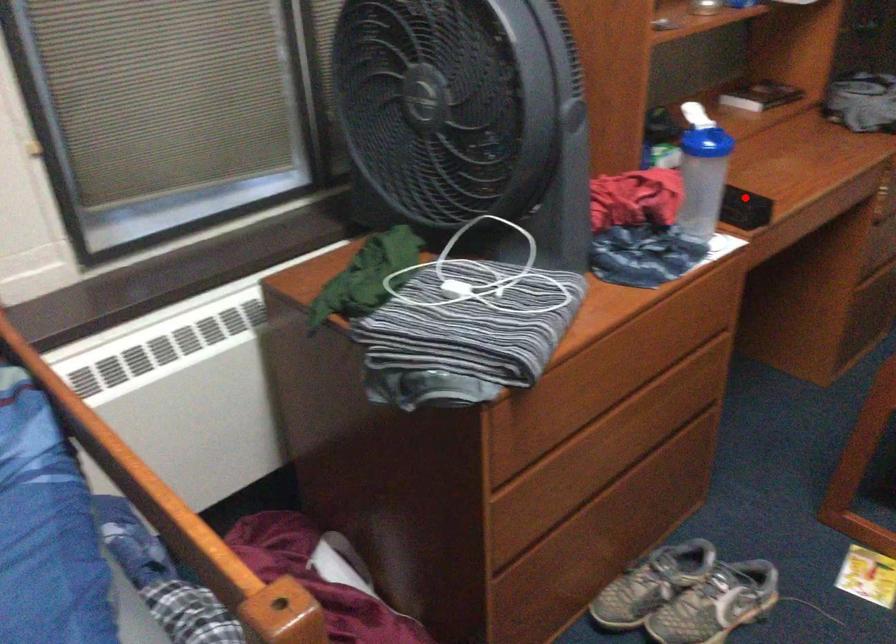
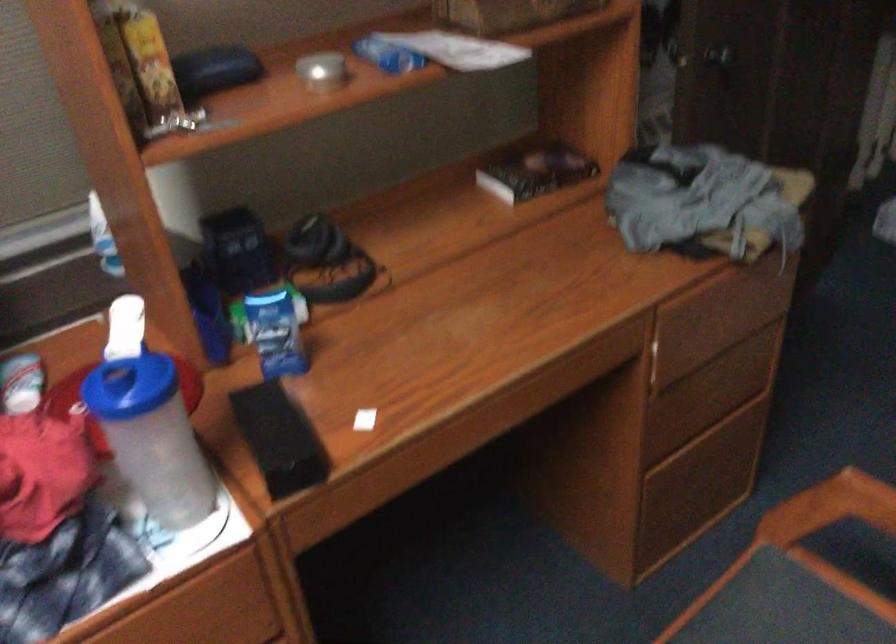
Question: I am providing you with two images of the same scene from different viewpoints. A red point is shown in image1. For the corresponding object point in image2, is it positioned nearer or farther from the camera?

Choices:
 (A) Nearer
 (B) Farther

Answer: (A)